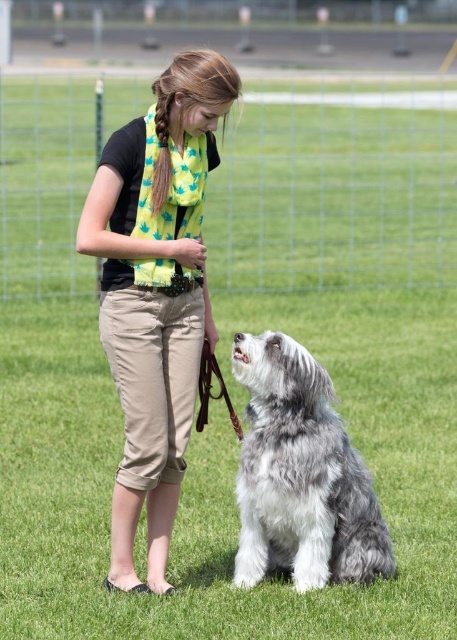
You are a fashion designer observing the scene. You want to create a new scarf design that matches the size of the green scarf at center and the fluffy gray fur at center. Which object should you use as a reference for the scarf size?

The green scarf at center has a larger size compared to the fluffy gray fur at center, so you should use the green scarf at center as the reference for the scarf size.